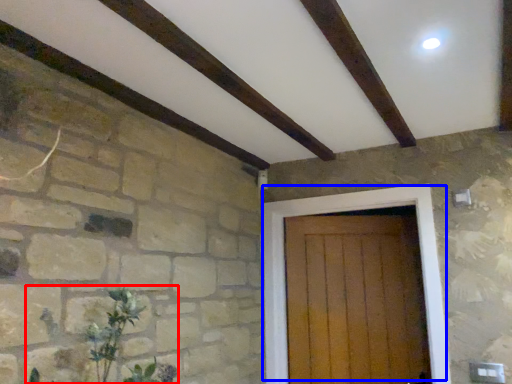
Question: Which of the following is the closest to the observer, plant (highlighted by a red box) or door (highlighted by a blue box)?

Choices:
 (A) plant
 (B) door

Answer: (A)